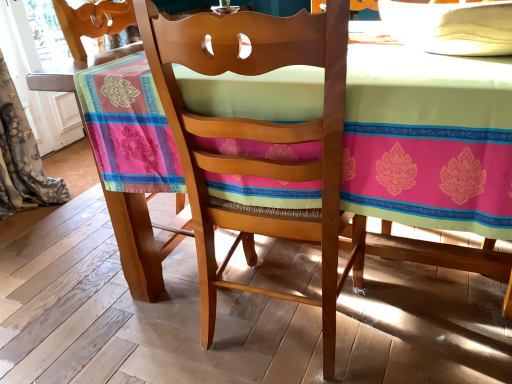
Question: Relative to wooden table at center, is wooden chair at center in front or behind?

Choices:
 (A) behind
 (B) front

Answer: (A)

Question: Is wooden chair at center wider or thinner than wooden table at center?

Choices:
 (A) thin
 (B) wide

Answer: (A)

Question: Based on their relative distances, which object is nearer to the wooden chair at center?

Choices:
 (A) wooden table at center
 (B) floral fabric curtain at left

Answer: (A)

Question: Estimate the real-world distances between objects in this image. Which object is farther from the wooden chair at center?

Choices:
 (A) floral fabric curtain at left
 (B) wooden table at center

Answer: (A)